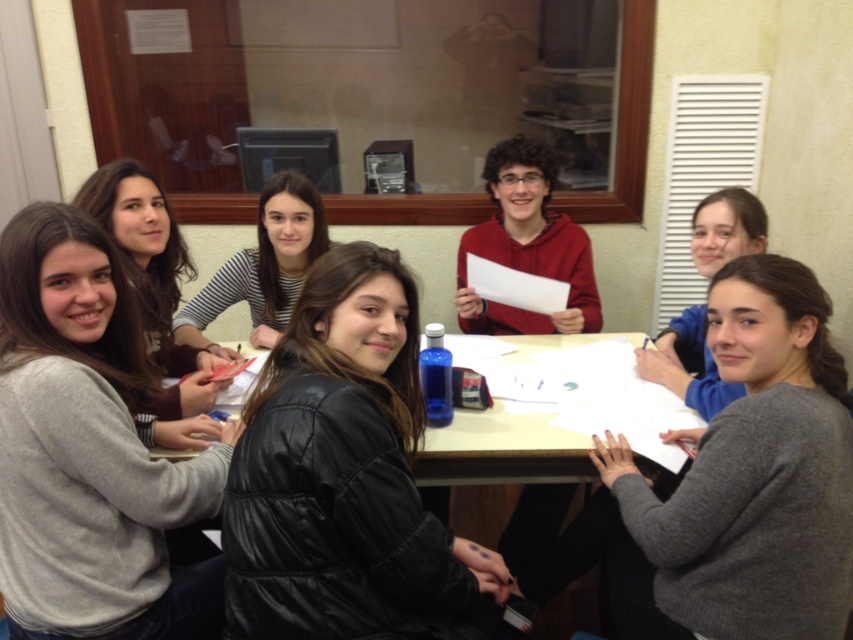
Between point (572, 232) and point (454, 460), which one is positioned in front?

Point (454, 460)

This screenshot has height=640, width=853. What do you see at coordinates (527, 244) in the screenshot? I see `matte red hoodie at center` at bounding box center [527, 244].

Does point (531, 266) come in front of point (436, 442)?

No, it is behind (436, 442).

This screenshot has width=853, height=640. In order to click on matte red hoodie at center in this screenshot , I will do `click(527, 244)`.

Does point (207, 602) come behind point (524, 221)?

No.

Does gray sweater at upper left appear under matte red hoodie at center?

Yes.

Consider the image. Who is more forward, [120,282] or [585,321]?

Point [120,282] is more forward.

This screenshot has width=853, height=640. Identify the location of gray sweater at upper left. (90, 451).

Between black leather jacket at center and smooth wooden table at center, which one is positioned lower?

smooth wooden table at center is below.

In order to click on black leather jacket at center in this screenshot , I will do `click(343, 476)`.